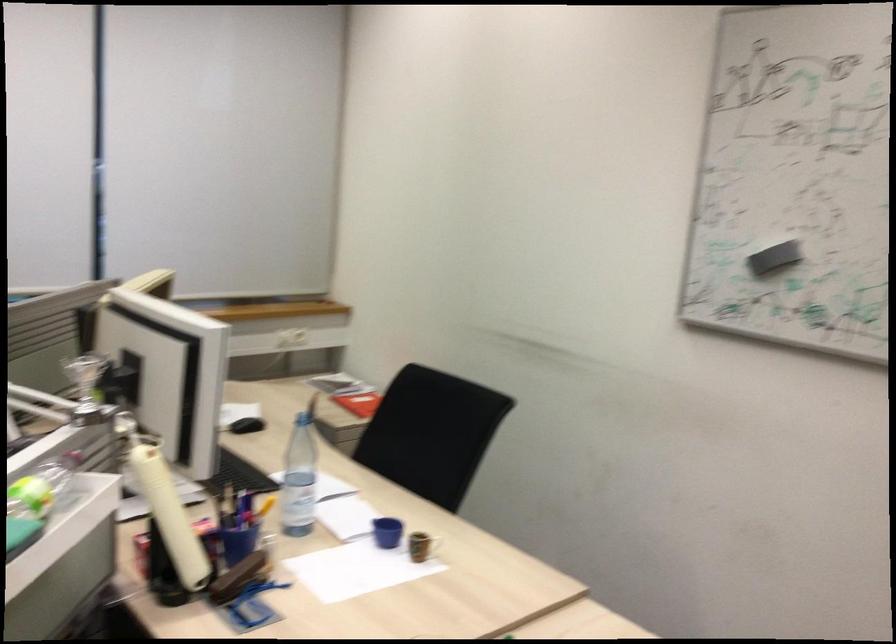
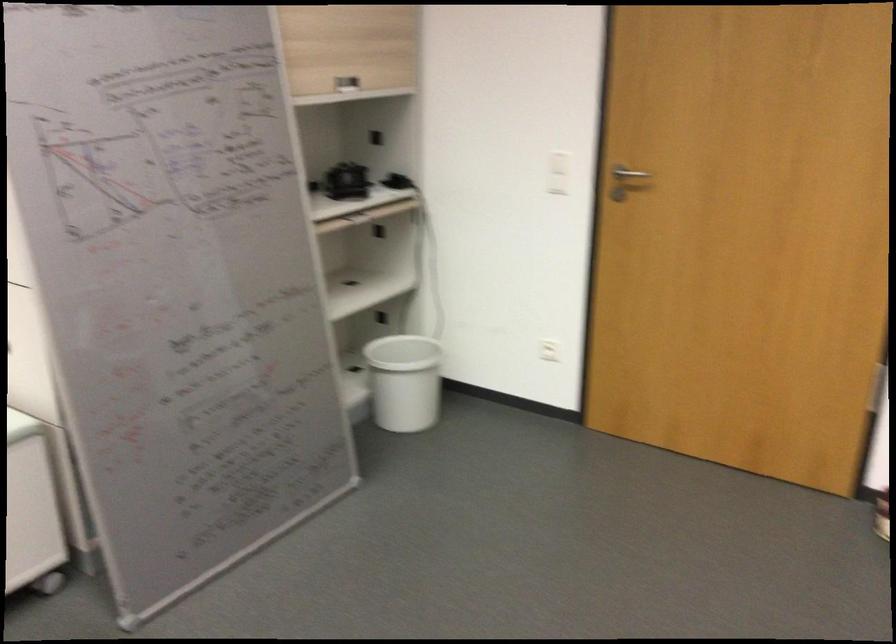
The first image is from the beginning of the video and the second image is from the end. How did the camera likely rotate when shooting the video?

The camera rotated toward right-down.